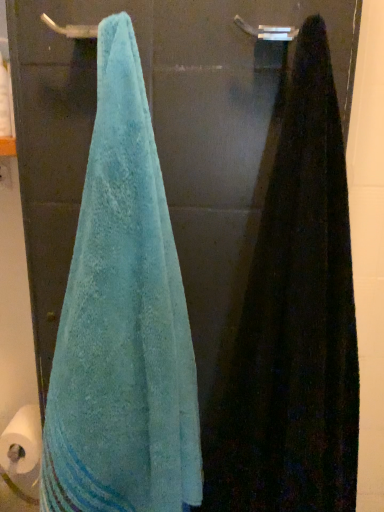
Where is `teal terry cloth towel at left, the 1th towel in the left-to-right sequence`? teal terry cloth towel at left, the 1th towel in the left-to-right sequence is located at coordinates (122, 322).

In order to face black fuzzy towel at right, marked as the 1th towel in a right-to-left arrangement, should I rotate leftwards or rightwards?

It's best to rotate right around 14.547 degrees.

The image size is (384, 512). I want to click on teal terry cloth towel at left, the 2th towel positioned from the right, so click(122, 322).

Is teal terry cloth towel at left, the 1th towel in the left-to-right sequence, in contact with black fuzzy towel at right, the second towel viewed from the left?

No, teal terry cloth towel at left, the 1th towel in the left-to-right sequence, is not beside black fuzzy towel at right, the second towel viewed from the left.

From a real-world perspective, is teal terry cloth towel at left, the 1th towel in the left-to-right sequence, on black fuzzy towel at right, the second towel viewed from the left?

No, from a real-world perspective, teal terry cloth towel at left, the 1th towel in the left-to-right sequence, is not over black fuzzy towel at right, the second towel viewed from the left

Between teal terry cloth towel at left, the 2th towel positioned from the right, and silver metallic towel bar at upper center, which one is positioned behind?

silver metallic towel bar at upper center is behind.

Is teal terry cloth towel at left, the 2th towel positioned from the right, turned away from silver metallic towel bar at upper center?

teal terry cloth towel at left, the 2th towel positioned from the right, is not turned away from silver metallic towel bar at upper center.

How far apart are teal terry cloth towel at left, the 2th towel positioned from the right, and silver metallic towel bar at upper center?

teal terry cloth towel at left, the 2th towel positioned from the right, and silver metallic towel bar at upper center are 47.36 centimeters apart from each other.

The width and height of the screenshot is (384, 512). In order to click on towel bar that appears behind the teal terry cloth towel at left, the 1th towel in the left-to-right sequence in this screenshot , I will do `click(267, 31)`.

Considering their positions, is silver metallic towel bar at upper center located in front of or behind black fuzzy towel at right, the second towel viewed from the left?

In the image, silver metallic towel bar at upper center appears behind black fuzzy towel at right, the second towel viewed from the left.

Can you confirm if silver metallic towel bar at upper center is wider than black fuzzy towel at right, the second towel viewed from the left?

No, silver metallic towel bar at upper center is not wider than black fuzzy towel at right, the second towel viewed from the left.

Considering the points (289, 34) and (329, 390), which point is in front, point (289, 34) or point (329, 390)?

Positioned in front is point (289, 34).

Is black fuzzy towel at right, marked as the 1th towel in a right-to-left arrangement, at the back of silver metallic towel bar at upper center?

No.

Which object is thinner, black fuzzy towel at right, marked as the 1th towel in a right-to-left arrangement, or teal terry cloth towel at left, the 2th towel positioned from the right?

Thinner between the two is teal terry cloth towel at left, the 2th towel positioned from the right.

From a real-world perspective, is black fuzzy towel at right, the second towel viewed from the left, positioned over teal terry cloth towel at left, the 1th towel in the left-to-right sequence, based on gravity?

Yes, from a real-world perspective, black fuzzy towel at right, the second towel viewed from the left, is above teal terry cloth towel at left, the 1th towel in the left-to-right sequence.

Considering the positions of objects black fuzzy towel at right, the second towel viewed from the left, and teal terry cloth towel at left, the 2th towel positioned from the right, in the image provided, who is more to the left, black fuzzy towel at right, the second towel viewed from the left, or teal terry cloth towel at left, the 2th towel positioned from the right,?

teal terry cloth towel at left, the 2th towel positioned from the right, is more to the left.

Is black fuzzy towel at right, the second towel viewed from the left, positioned behind teal terry cloth towel at left, the 1th towel in the left-to-right sequence?

No, black fuzzy towel at right, the second towel viewed from the left, is closer to the camera.

Is black fuzzy towel at right, marked as the 1th towel in a right-to-left arrangement, inside the boundaries of silver metallic towel bar at upper center, or outside?

black fuzzy towel at right, marked as the 1th towel in a right-to-left arrangement, is not enclosed by silver metallic towel bar at upper center.

Does black fuzzy towel at right, the second towel viewed from the left, have a lesser height compared to silver metallic towel bar at upper center?

In fact, black fuzzy towel at right, the second towel viewed from the left, may be taller than silver metallic towel bar at upper center.

Between black fuzzy towel at right, the second towel viewed from the left, and silver metallic towel bar at upper center, which one has smaller width?

Thinner between the two is silver metallic towel bar at upper center.

Is black fuzzy towel at right, the second towel viewed from the left, positioned with its back to silver metallic towel bar at upper center?

Yes, black fuzzy towel at right, the second towel viewed from the left, is positioned with its back facing silver metallic towel bar at upper center.

Does point (290, 34) lie behind point (123, 220)?

No, it is in front of (123, 220).

From the image's perspective, is silver metallic towel bar at upper center located beneath teal terry cloth towel at left, the 1th towel in the left-to-right sequence?

No, from the image's perspective, silver metallic towel bar at upper center is not below teal terry cloth towel at left, the 1th towel in the left-to-right sequence.

Which is correct: silver metallic towel bar at upper center is inside teal terry cloth towel at left, the 1th towel in the left-to-right sequence, or outside of it?

silver metallic towel bar at upper center cannot be found inside teal terry cloth towel at left, the 1th towel in the left-to-right sequence.

This screenshot has height=512, width=384. There is a silver metallic towel bar at upper center. Identify the location of the 1st towel below it (from the image's perspective). (122, 322).

The image size is (384, 512). Identify the location of towel on the right of teal terry cloth towel at left, the 1th towel in the left-to-right sequence. (294, 321).

Locate an element on the screen. Image resolution: width=384 pixels, height=512 pixels. towel bar lying above the teal terry cloth towel at left, the 1th towel in the left-to-right sequence (from the image's perspective) is located at coordinates (267, 31).

Looking at this image, when comparing their distances from black fuzzy towel at right, marked as the 1th towel in a right-to-left arrangement, does teal terry cloth towel at left, the 2th towel positioned from the right, or silver metallic towel bar at upper center seem closer?

teal terry cloth towel at left, the 2th towel positioned from the right, lies closer to black fuzzy towel at right, marked as the 1th towel in a right-to-left arrangement, than the other object.

Considering their positions, is silver metallic towel bar at upper center positioned closer to teal terry cloth towel at left, the 2th towel positioned from the right, than black fuzzy towel at right, the second towel viewed from the left?

The object closer to teal terry cloth towel at left, the 2th towel positioned from the right, is black fuzzy towel at right, the second towel viewed from the left.

When comparing their distances from teal terry cloth towel at left, the 1th towel in the left-to-right sequence, does black fuzzy towel at right, the second towel viewed from the left, or silver metallic towel bar at upper center seem closer?

black fuzzy towel at right, the second towel viewed from the left, is closer to teal terry cloth towel at left, the 1th towel in the left-to-right sequence.

Based on the photo, based on their spatial positions, is silver metallic towel bar at upper center or teal terry cloth towel at left, the 1th towel in the left-to-right sequence, further from black fuzzy towel at right, the second towel viewed from the left?

silver metallic towel bar at upper center.

From the image, which object appears to be nearer to silver metallic towel bar at upper center, black fuzzy towel at right, the second towel viewed from the left, or teal terry cloth towel at left, the 2th towel positioned from the right?

Among the two, black fuzzy towel at right, the second towel viewed from the left, is located nearer to silver metallic towel bar at upper center.

From the image, which object appears to be nearer to silver metallic towel bar at upper center, teal terry cloth towel at left, the 1th towel in the left-to-right sequence, or black fuzzy towel at right, marked as the 1th towel in a right-to-left arrangement?

The object closer to silver metallic towel bar at upper center is black fuzzy towel at right, marked as the 1th towel in a right-to-left arrangement.

Find the location of a particular element. The height and width of the screenshot is (512, 384). towel between silver metallic towel bar at upper center and black fuzzy towel at right, marked as the 1th towel in a right-to-left arrangement, in the up-down direction is located at coordinates (122, 322).